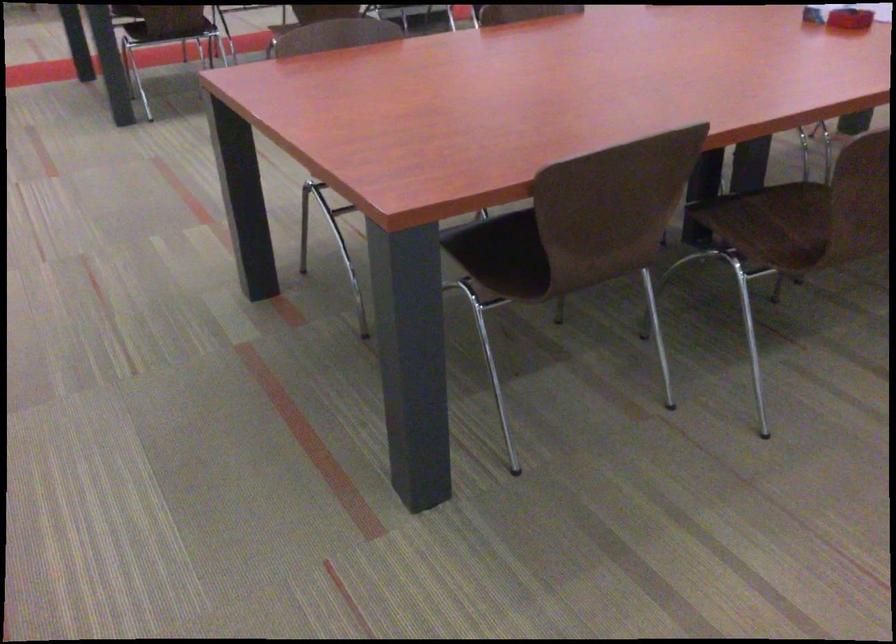
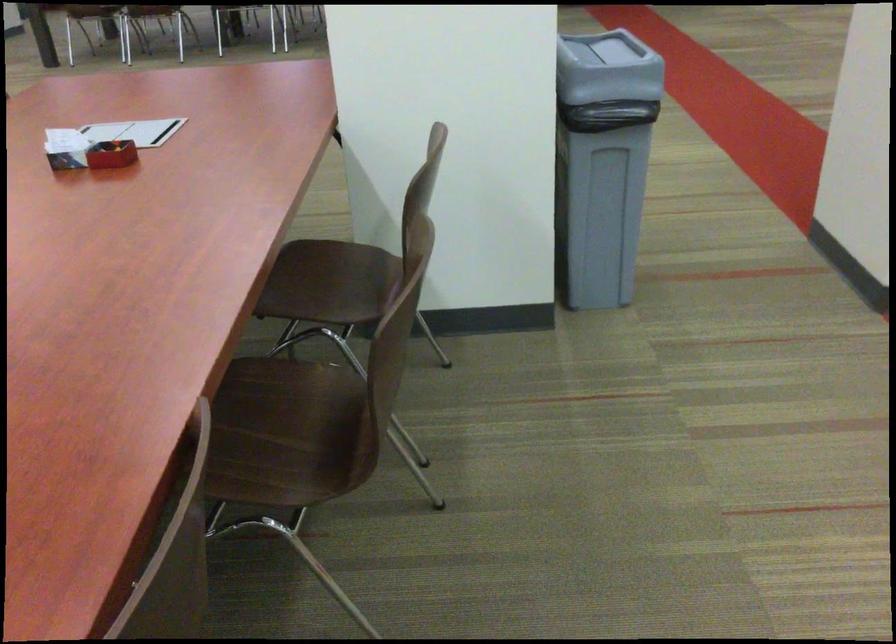
Question: The first image is from the beginning of the video and the second image is from the end. How did the camera likely rotate when shooting the video?

Choices:
 (A) Left
 (B) Right
 (C) Up
 (D) Down

Answer: (B)